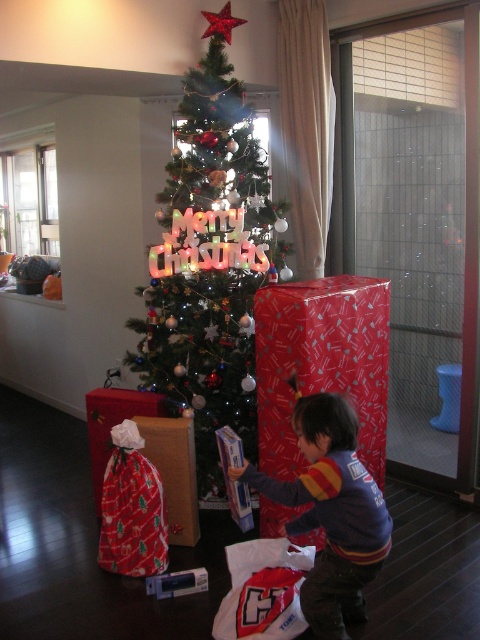
You are a guest at a Christmas party and see the shiny green christmas tree at center and the striped sweater at lower center. Which object is wider from your perspective?

The shiny green christmas tree at center is wider than the striped sweater at lower center according to the description.

You are standing in front of the Christmas tree and want to place a new ornament. You have two points marked as potential locations for hanging the ornament. The first point is at coordinates point (247, 262) and the second is at point (282, 492). Which point is closer to you?

Point (282, 492) is closer to you because it is in front of point (247, 262).

You are standing in the living room and see the shiny green christmas tree at center and the striped sweater at lower center. Which object is closer to you?

The striped sweater at lower center is closer to you because the shiny green christmas tree at center is positioned over it, meaning the tree is behind the sweater.